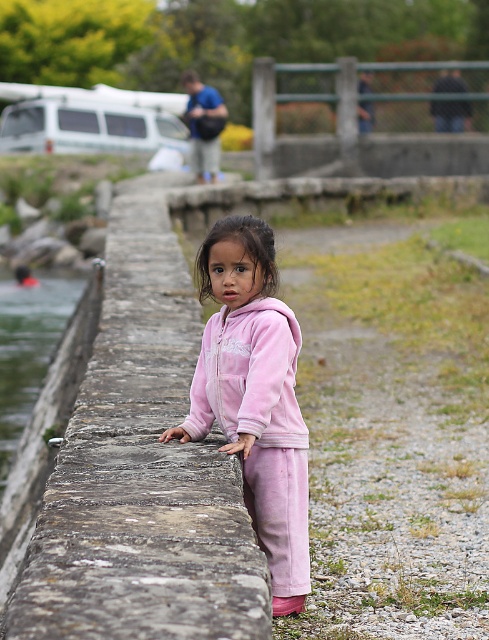
Can you confirm if velvet pink tracksuit at center is taller than green metal fence at upper center?

In fact, velvet pink tracksuit at center may be shorter than green metal fence at upper center.

Can you confirm if velvet pink tracksuit at center is positioned below green metal fence at upper center?

Yes, velvet pink tracksuit at center is below green metal fence at upper center.

Identify the location of velvet pink tracksuit at center. This screenshot has height=640, width=489. (254, 396).

You are a GUI agent. You are given a task and a screenshot of the screen. Output one action in this format:
    pyautogui.click(x=<x>, y=<y>)
    Task: Click on the velvet pink tracksuit at center
    This screenshot has width=489, height=640.
    Given the screenshot: What is the action you would take?
    pyautogui.click(x=254, y=396)

Which of these two, stone wall at center or velvet pink tracksuit at center, stands shorter?

Standing shorter between the two is velvet pink tracksuit at center.

From the picture: Is stone wall at center further to the viewer compared to velvet pink tracksuit at center?

That is False.

Locate an element on the screen. stone wall at center is located at coordinates (130, 465).

This screenshot has width=489, height=640. I want to click on stone wall at center, so click(130, 465).

Can you confirm if stone wall at center is taller than clear water at left?

Indeed, stone wall at center has a greater height compared to clear water at left.

Which is in front, point (74, 413) or point (60, 273)?

Point (74, 413) is in front.

This screenshot has height=640, width=489. Find the location of `stone wall at center`. stone wall at center is located at coordinates (130, 465).